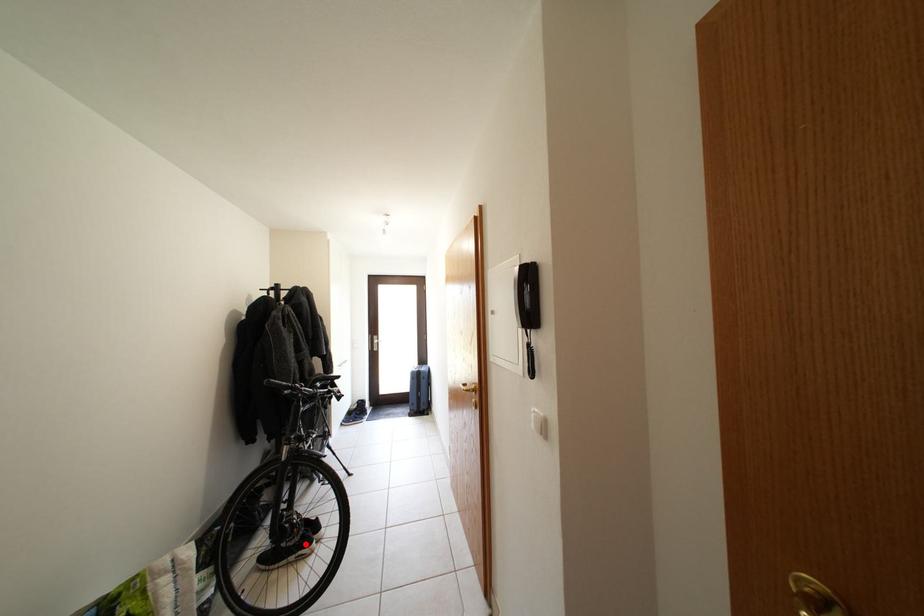
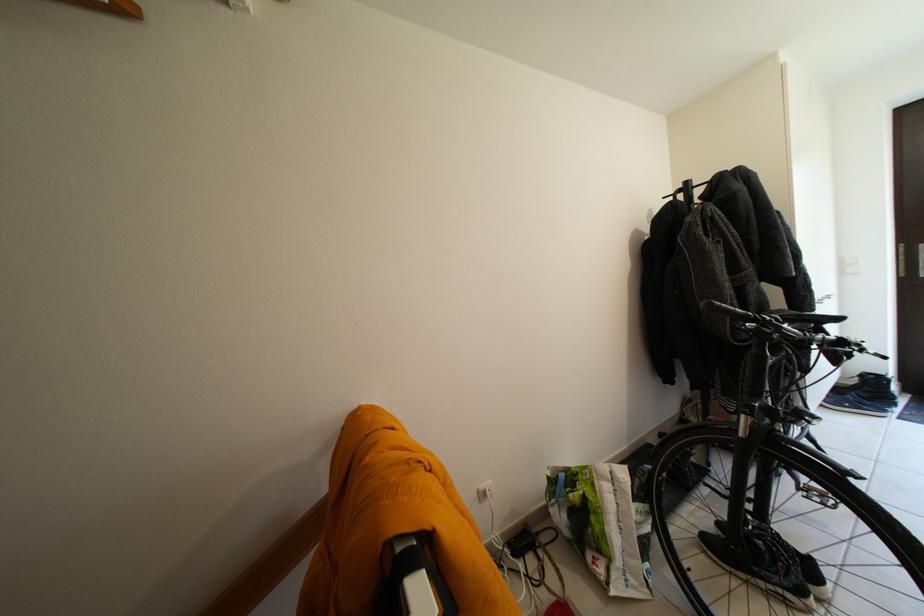
Question: I am providing you with two images of the same scene from different viewpoints. A red point is shown in image1. For the corresponding object point in image2, is it positioned nearer or farther from the camera?

Choices:
 (A) Nearer
 (B) Farther

Answer: (B)